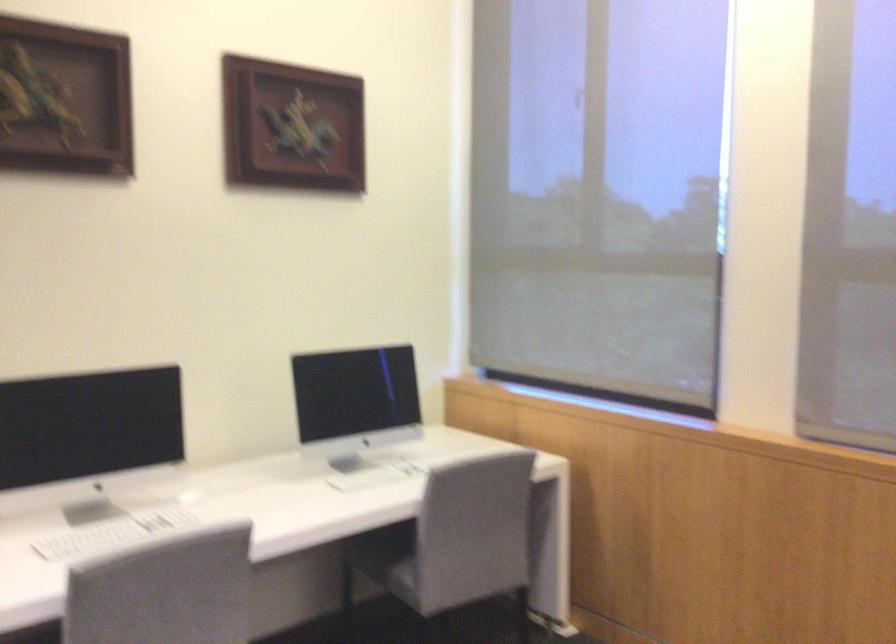
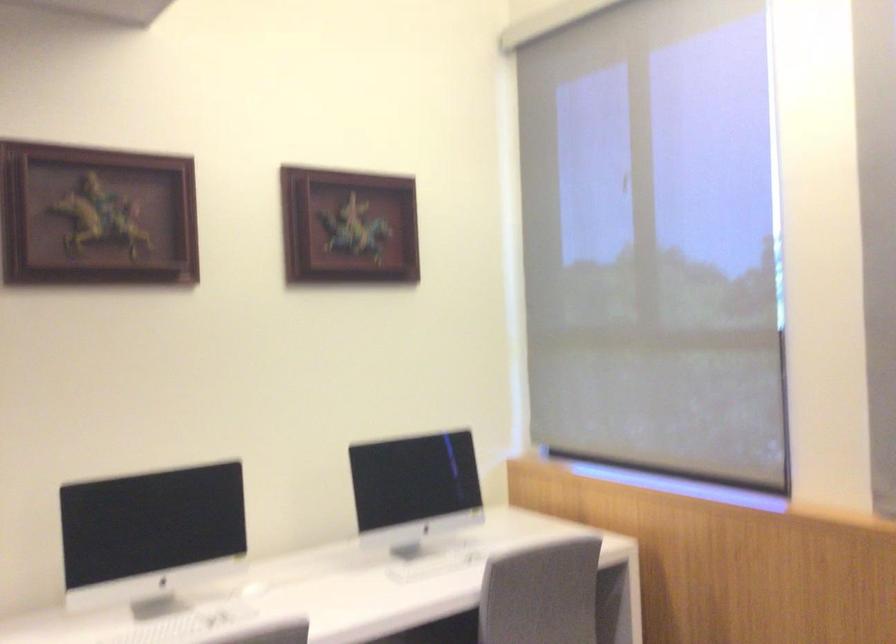
Question: Based on the continuous images, in which direction is the camera rotating? Reply with the corresponding letter.

Choices:
 (A) Left
 (B) Right
 (C) Up
 (D) Down

Answer: (C)